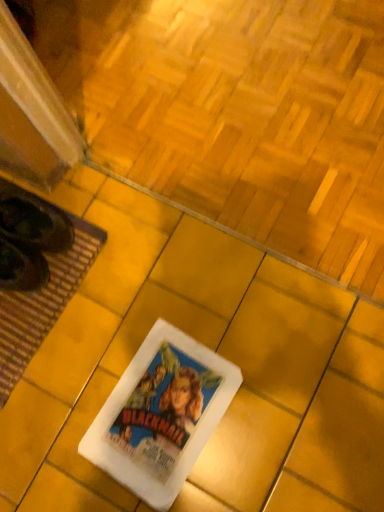
What is the approximate height of brown woven mat at lower left?

brown woven mat at lower left is 1.75 inches tall.

I want to click on white paper movie poster at center, so click(x=161, y=415).

You are a GUI agent. You are given a task and a screenshot of the screen. Output one action in this format:
    pyautogui.click(x=<x>, y=<y>)
    Task: Click on the brown woven mat at lower left
    The image size is (384, 512).
    Given the screenshot: What is the action you would take?
    coord(40,278)

Does white paper movie poster at center have a larger size compared to white paper at center?

No, white paper movie poster at center is not bigger than white paper at center.

You are a GUI agent. You are given a task and a screenshot of the screen. Output one action in this format:
    pyautogui.click(x=<x>, y=<y>)
    Task: Click on the square on the right of white paper movie poster at center
    The image size is (384, 512).
    Given the screenshot: What is the action you would take?
    pyautogui.click(x=249, y=118)

From the image's perspective, is white paper movie poster at center positioned above or below white paper at center?

From the image's perspective, white paper movie poster at center appears below white paper at center.

From a real-world perspective, is white paper movie poster at center positioned over white paper at center based on gravity?

Yes, from a real-world perspective, white paper movie poster at center is on top of white paper at center.

Which of these two, white paper at center or white paper movie poster at center, is bigger?

white paper at center.

Is white paper at center positioned with its back to white paper movie poster at center?

That's not correct — white paper at center is not looking away from white paper movie poster at center.

Between white paper at center and white paper movie poster at center, which one appears on the left side from the viewer's perspective?

Positioned to the left is white paper movie poster at center.

Looking at this image, is white paper at center taller than white paper movie poster at center?

Yes.

Which is correct: brown woven mat at lower left is inside white paper at center, or outside of it?

brown woven mat at lower left cannot be found inside white paper at center.

Considering the sizes of objects brown woven mat at lower left and white paper at center in the image provided, who is thinner, brown woven mat at lower left or white paper at center?

brown woven mat at lower left is thinner.

The image size is (384, 512). What are the coordinates of `square that is in front of the brown woven mat at lower left` in the screenshot? It's located at (249, 118).

Is brown woven mat at lower left bigger than white paper at center?

Incorrect, brown woven mat at lower left is not larger than white paper at center.

Would you say white paper movie poster at center is part of brown woven mat at lower left's contents?

That's incorrect, white paper movie poster at center is not inside brown woven mat at lower left.

Looking at this image, is brown woven mat at lower left placed right next to white paper movie poster at center?

No, brown woven mat at lower left is not touching white paper movie poster at center.

Considering the relative positions of brown woven mat at lower left and white paper movie poster at center in the image provided, is brown woven mat at lower left behind white paper movie poster at center?

Yes, brown woven mat at lower left is behind white paper movie poster at center.

In the scene shown: Is white paper movie poster at center turned away from brown woven mat at lower left?

No, white paper movie poster at center is not facing the opposite direction of brown woven mat at lower left.

Between point (152, 486) and point (44, 322), which one is positioned behind?

The point (44, 322) is farther.

At what (x,y) coordinates should I click in order to perform the action: click on movie poster on the right of brown woven mat at lower left. Please return your answer as a coordinate pair (x, y). Looking at the image, I should click on (161, 415).

Which object is positioned more to the left, white paper movie poster at center or brown woven mat at lower left?

brown woven mat at lower left is more to the left.

Is white paper at center bigger than brown woven mat at lower left?

Yes.

Is white paper at center located outside brown woven mat at lower left?

white paper at center lies outside brown woven mat at lower left's area.

Looking at this image, which is more to the left, white paper at center or brown woven mat at lower left?

From the viewer's perspective, brown woven mat at lower left appears more on the left side.

I want to click on movie poster below the white paper at center (from the image's perspective), so click(161, 415).

Locate an element on the screen. The width and height of the screenshot is (384, 512). movie poster above the white paper at center (from a real-world perspective) is located at coordinates (161, 415).

Consider the image. From the image, which object appears to be farther from white paper movie poster at center, white paper at center or brown woven mat at lower left?

white paper at center is positioned further to the anchor white paper movie poster at center.

Estimate the real-world distances between objects in this image. Which object is further from white paper movie poster at center, brown woven mat at lower left or white paper at center?

white paper at center is further to white paper movie poster at center.

When comparing their distances from brown woven mat at lower left, does white paper at center or white paper movie poster at center seem closer?

white paper movie poster at center is positioned closer to the anchor brown woven mat at lower left.

When comparing their distances from white paper at center, does brown woven mat at lower left or white paper movie poster at center seem further?

white paper movie poster at center lies further to white paper at center than the other object.

When comparing their distances from white paper at center, does white paper movie poster at center or brown woven mat at lower left seem closer?

Among the two, brown woven mat at lower left is located nearer to white paper at center.

In the scene shown: Which object lies further to the anchor point brown woven mat at lower left, white paper movie poster at center or white paper at center?

white paper at center is further to brown woven mat at lower left.

Where is `mat that lies between white paper at center and white paper movie poster at center from top to bottom`? The image size is (384, 512). mat that lies between white paper at center and white paper movie poster at center from top to bottom is located at coordinates (40, 278).